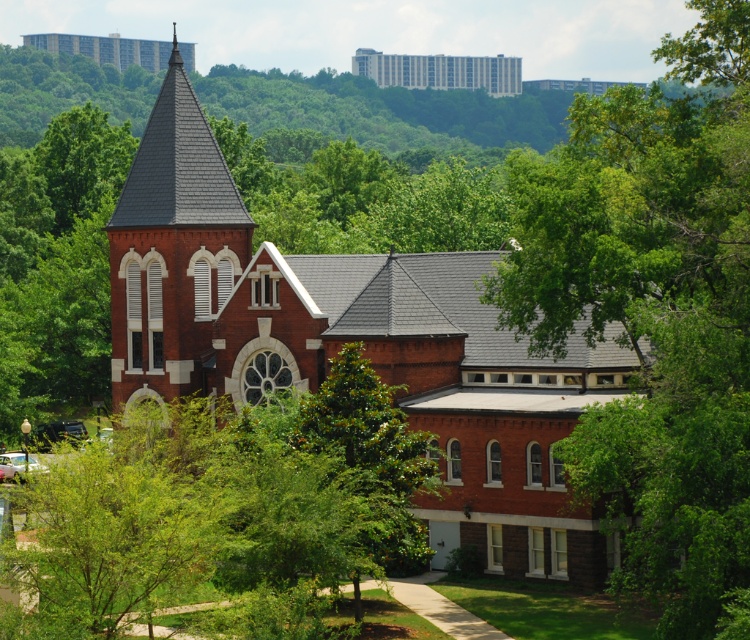
Question: Which point is farther to the camera?

Choices:
 (A) brick church at center
 (B) brick church at upper center
 (C) green leafy tree at center

Answer: (B)

Question: Among these objects, which one is nearest to the camera?

Choices:
 (A) brick church at center
 (B) brick church at upper center
 (C) green leafy tree at center
 (D) matte brick church at upper center

Answer: (C)

Question: Does brick church at center have a larger size compared to brick church at upper center?

Choices:
 (A) yes
 (B) no

Answer: (B)

Question: Is green leafy tree at center further to camera compared to matte brick church at upper center?

Choices:
 (A) no
 (B) yes

Answer: (A)

Question: Is brick church at center to the left of brick church at upper center from the viewer's perspective?

Choices:
 (A) no
 (B) yes

Answer: (A)

Question: Among these objects, which one is nearest to the camera?

Choices:
 (A) brick church at upper center
 (B) brick church at center

Answer: (B)